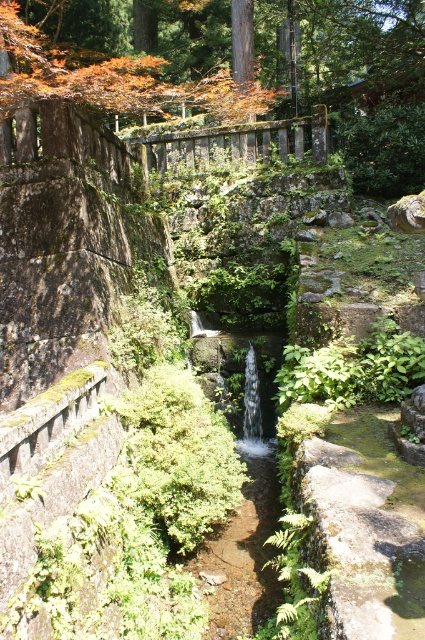
Question: Can you confirm if rustic stone balustrade at upper center is positioned above silver metallic waterfall at center?

Choices:
 (A) yes
 (B) no

Answer: (A)

Question: Which point is closer to the camera taking this photo?

Choices:
 (A) (189, 20)
 (B) (246, 397)

Answer: (B)

Question: Which point appears farthest from the camera in this image?

Choices:
 (A) pyautogui.click(x=351, y=52)
 (B) pyautogui.click(x=251, y=419)

Answer: (A)

Question: Which of these objects is positioned farthest from the orange leafy tree at upper left?

Choices:
 (A) rustic stone balustrade at upper center
 (B) silver metallic waterfall at center

Answer: (B)

Question: Does rustic stone balustrade at upper center appear on the left side of silver metallic waterfall at center?

Choices:
 (A) no
 (B) yes

Answer: (B)

Question: Is rustic stone balustrade at upper center closer to camera compared to silver metallic waterfall at center?

Choices:
 (A) no
 (B) yes

Answer: (A)